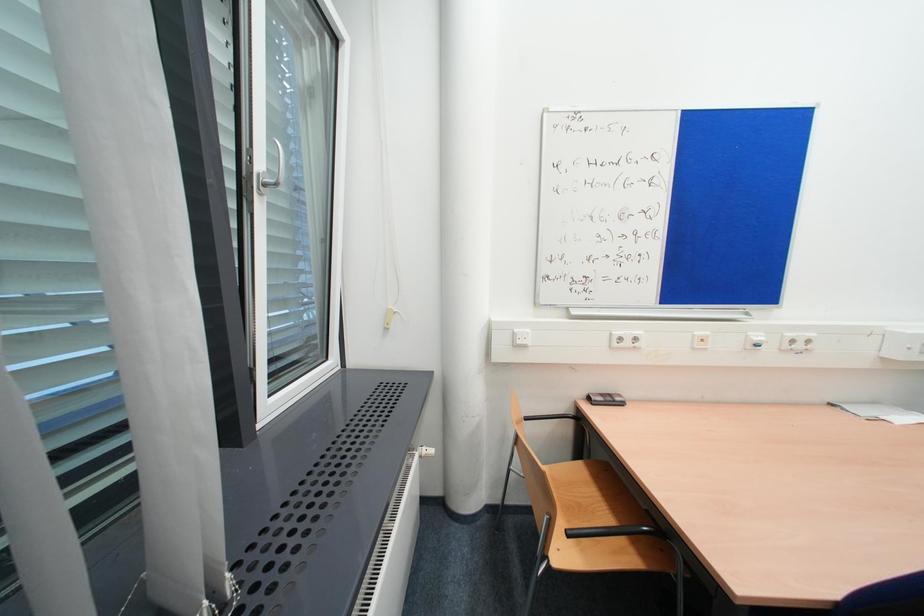
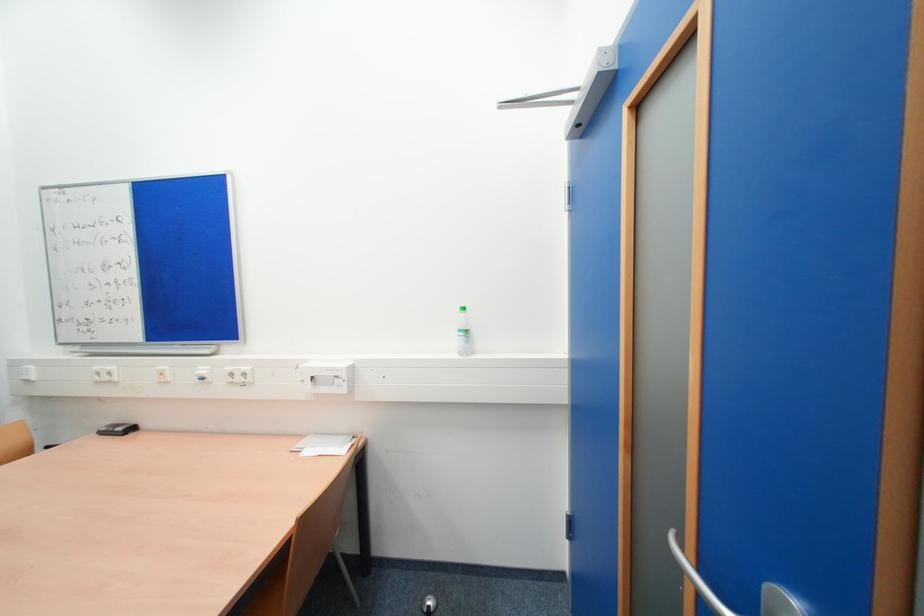
Question: Which direction would the cameraman need to move to produce the second image? Reply with the corresponding letter.

Choices:
 (A) Left
 (B) Right
 (C) Forward
 (D) Backward

Answer: (B)